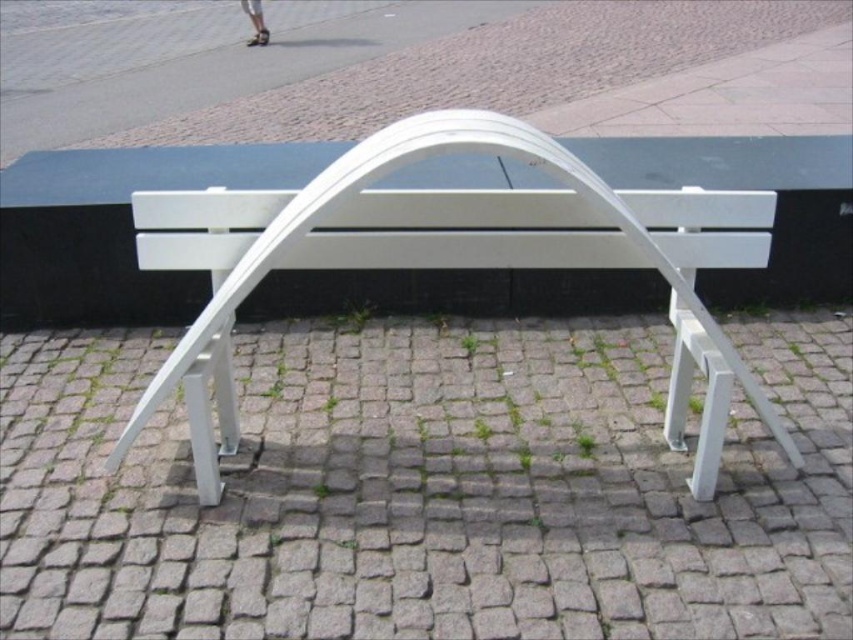
You are standing in front of a modern white bench with a curved backrest. You want to place a small potted plant on the gray cobblestone pavement at center. If you are currently standing 5 feet away from the pavement, can you reach it without moving closer?

The gray cobblestone pavement at center is 4.64 feet away from the camera. Since you are standing 5 feet away from it, you are slightly farther than the required distance. Therefore, you cannot reach it without moving closer.

Based on the photo, you are standing at the point labeled as point [425,488] in the image. What is the material of the surface you are currently standing on?

The point [425,488] is on gray cobblestone pavement at center, so the surface material is gray cobblestone pavement.

You are a delivery person trying to park your 1.2 meter wide cart between the gray cobblestone pavement at center and the white matte bench at center. Can you fit your cart there?

The gray cobblestone pavement at center might be wider than the white matte bench at center, so it is possible that the space between them is wide enough to accommodate your 1.2 meter wide cart. However, without exact measurements, this is uncertain.